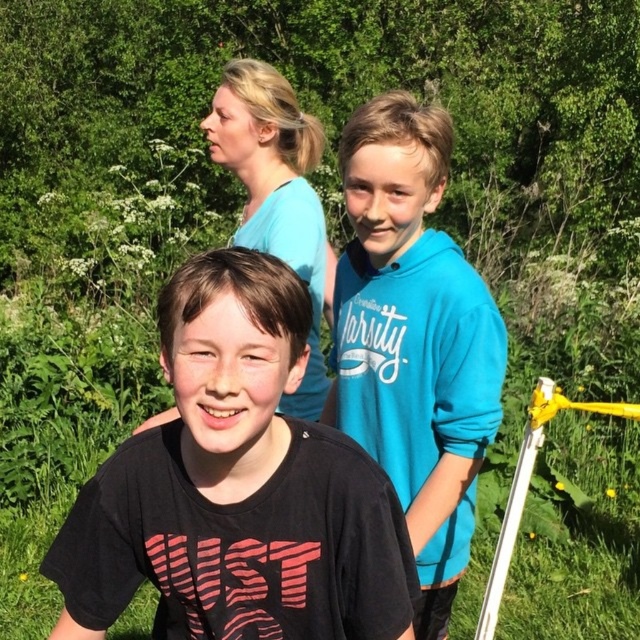
Which is behind, point (109, 532) or point (296, 148)?

Point (296, 148)

Does black matte shirt at center have a greater height compared to blue cotton shirt at upper center?

Incorrect, black matte shirt at center's height is not larger of blue cotton shirt at upper center's.

Does point (228, 620) come farther from viewer compared to point (294, 163)?

That is False.

Identify the location of black matte shirt at center. The height and width of the screenshot is (640, 640). (237, 484).

Does blue fleece hoodie at center appear on the left side of blue cotton shirt at upper center?

Incorrect, blue fleece hoodie at center is not on the left side of blue cotton shirt at upper center.

Between point (438, 275) and point (300, 163), which one is positioned behind?

The point (300, 163) is more distant.

The width and height of the screenshot is (640, 640). Identify the location of blue fleece hoodie at center. (413, 339).

Is black matte shirt at center taller than blue fleece hoodie at center?

Incorrect, black matte shirt at center's height is not larger of blue fleece hoodie at center's.

Between point (289, 429) and point (356, 276), which one is positioned in front?

Point (289, 429)

Is point (346, 552) farther from viewer compared to point (422, 620)?

No, (346, 552) is closer to viewer.

Where is `black matte shirt at center`? This screenshot has height=640, width=640. black matte shirt at center is located at coordinates click(x=237, y=484).